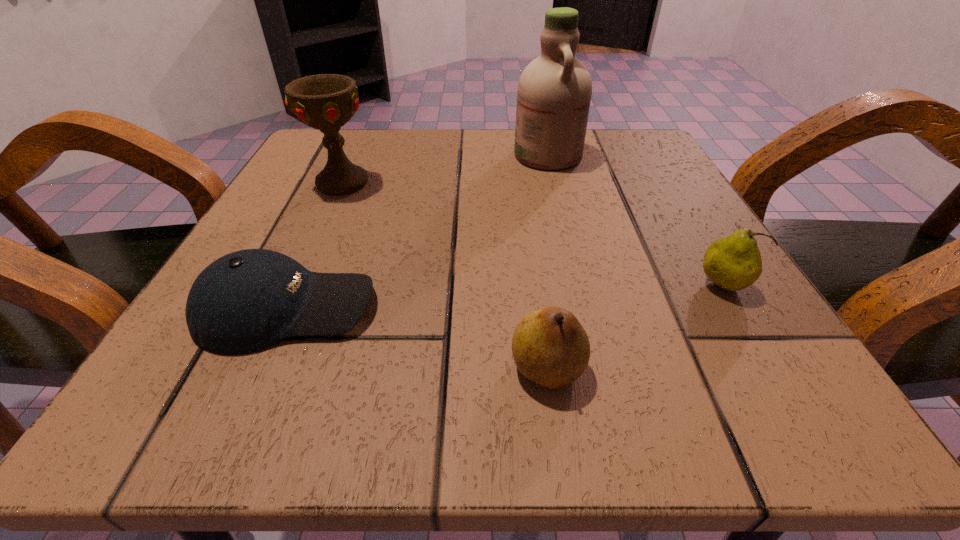
This screenshot has width=960, height=540. I want to click on object that ranks as the third closest to the right pear, so click(245, 301).

Where is `free location that satisfies the following two spatial constraints: 1. on the front label of the tallest object; 2. on the back side of the right pear`? The width and height of the screenshot is (960, 540). free location that satisfies the following two spatial constraints: 1. on the front label of the tallest object; 2. on the back side of the right pear is located at coordinates (580, 286).

Locate an element on the screen. vacant region that satisfies the following two spatial constraints: 1. on the front-facing side of the shortest object; 2. on the back side of the left pear is located at coordinates (259, 368).

This screenshot has width=960, height=540. I want to click on vacant area that satisfies the following two spatial constraints: 1. on the front side of the farther pear; 2. on the front-facing side of the baseball cap, so click(x=734, y=308).